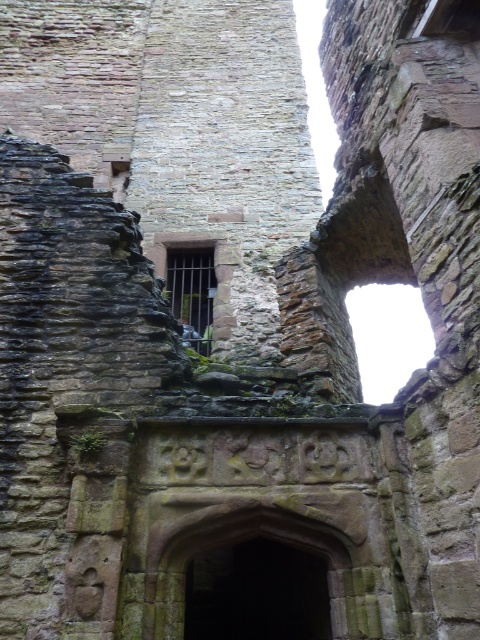
Is point (357, 628) closer to viewer compared to point (207, 252)?

That is True.

Describe the element at coordinates (255, 577) in the screenshot. I see `rustic stone archway at center` at that location.

You are a GUI agent. You are given a task and a screenshot of the screen. Output one action in this format:
    pyautogui.click(x=<x>, y=<y>)
    Task: Click on the rustic stone archway at center
    Image resolution: width=480 pixels, height=640 pixels.
    Given the screenshot: What is the action you would take?
    click(255, 577)